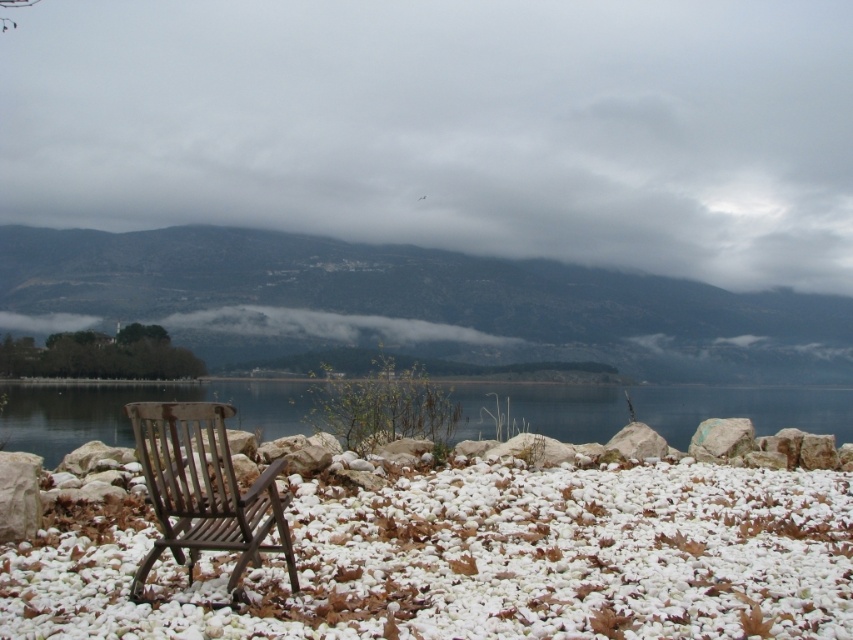
Identify the location of white gravel at center. (482, 561).

Can you confirm if white gravel at center is shorter than dark green forested mountain at left?

Correct, white gravel at center is not as tall as dark green forested mountain at left.

Describe the element at coordinates (482, 561) in the screenshot. I see `white gravel at center` at that location.

Where is `white gravel at center`? The image size is (853, 640). white gravel at center is located at coordinates (482, 561).

How distant is white gravel at center from wooden chair at lower left?

white gravel at center and wooden chair at lower left are 5.89 feet apart from each other.

Is white gravel at center behind wooden chair at lower left?

No.

This screenshot has width=853, height=640. Describe the element at coordinates (482, 561) in the screenshot. I see `white gravel at center` at that location.

Locate an element on the screen. The image size is (853, 640). white gravel at center is located at coordinates (482, 561).

Does point (315, 561) lie behind point (291, 413)?

No, it is not.

Can you confirm if white gravel at center is taller than transparent glass water at center?

No, white gravel at center is not taller than transparent glass water at center.

Does point (787, 477) come farther from viewer compared to point (596, 410)?

No, (787, 477) is closer to viewer.

At what (x,y) coordinates should I click in order to perform the action: click on white gravel at center. Please return your answer as a coordinate pair (x, y). Looking at the image, I should click on (482, 561).